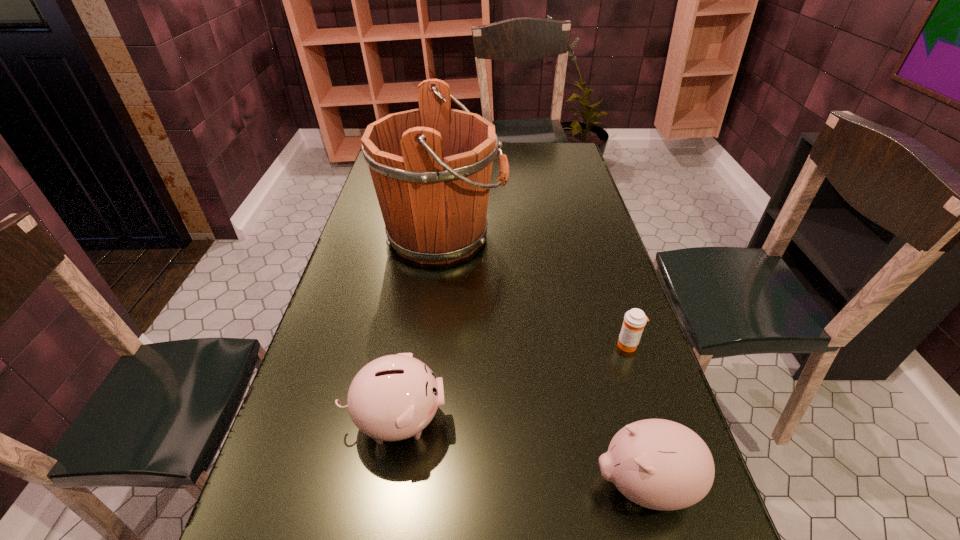
Find the location of a particular element. The width and height of the screenshot is (960, 540). free region located 0.340m at the snout of the right piggy bank is located at coordinates (410, 484).

Where is `free space located on the back of the second farthest object`? The height and width of the screenshot is (540, 960). free space located on the back of the second farthest object is located at coordinates (596, 245).

Where is `bucket that is at the left edge`? The image size is (960, 540). bucket that is at the left edge is located at coordinates (431, 167).

Find the location of a particular element. The height and width of the screenshot is (540, 960). piggy bank that is at the left edge is located at coordinates (x=394, y=397).

Image resolution: width=960 pixels, height=540 pixels. I want to click on piggy bank present at the right edge, so click(x=659, y=464).

Find the location of a particular element. This screenshot has height=540, width=960. medicine that is at the right edge is located at coordinates (634, 321).

The width and height of the screenshot is (960, 540). Identify the location of vacant space at the far edge. (510, 146).

Identify the location of free space at the left edge of the desktop. (332, 410).

Where is `blank space at the right edge of the desktop`? Image resolution: width=960 pixels, height=540 pixels. blank space at the right edge of the desktop is located at coordinates (565, 276).

Where is `free space between the right piggy bank and the bucket`? free space between the right piggy bank and the bucket is located at coordinates (543, 360).